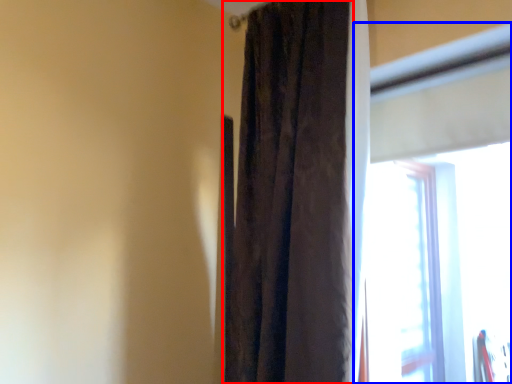
Question: Which object is closer to the camera taking this photo, curtain (highlighted by a red box) or window (highlighted by a blue box)?

Choices:
 (A) curtain
 (B) window

Answer: (B)